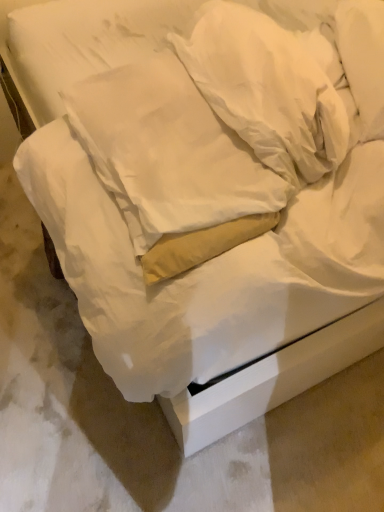
Question: Which direction should I rotate to face white soft pillow at upper center, the first pillow viewed from the right, — up or down?

Choices:
 (A) down
 (B) up

Answer: (B)

Question: Would you say white soft pillow at center, which appears as the 1th pillow when viewed from the left, is outside white soft pillow at upper center, the first pillow viewed from the right?

Choices:
 (A) no
 (B) yes

Answer: (B)

Question: Would you consider white soft pillow at center, the second pillow in the right-to-left sequence, to be distant from white soft pillow at upper center, the first pillow viewed from the right?

Choices:
 (A) yes
 (B) no

Answer: (B)

Question: Considering the relative sizes of white soft pillow at center, which appears as the 1th pillow when viewed from the left, and white soft pillow at upper center, the first pillow viewed from the right, in the image provided, is white soft pillow at center, which appears as the 1th pillow when viewed from the left, shorter than white soft pillow at upper center, the first pillow viewed from the right,?

Choices:
 (A) no
 (B) yes

Answer: (B)

Question: Is white soft pillow at center, which appears as the 1th pillow when viewed from the left, at the right side of white soft pillow at upper center, which is the second pillow in left-to-right order?

Choices:
 (A) yes
 (B) no

Answer: (B)

Question: Would you say white soft pillow at center, the second pillow in the right-to-left sequence, contains white soft pillow at upper center, the first pillow viewed from the right?

Choices:
 (A) no
 (B) yes

Answer: (A)

Question: From a real-world perspective, is white soft pillow at center, the second pillow in the right-to-left sequence, positioned over white soft pillow at upper center, which is the second pillow in left-to-right order, based on gravity?

Choices:
 (A) yes
 (B) no

Answer: (B)

Question: Is white soft pillow at upper center, which is the second pillow in left-to-right order, touching white soft pillow at center, the second pillow in the right-to-left sequence?

Choices:
 (A) no
 (B) yes

Answer: (A)

Question: Is white soft pillow at upper center, which is the second pillow in left-to-right order, further to camera compared to white soft pillow at center, the second pillow in the right-to-left sequence?

Choices:
 (A) yes
 (B) no

Answer: (A)

Question: Is white soft pillow at upper center, which is the second pillow in left-to-right order, to the left of white soft pillow at center, which appears as the 1th pillow when viewed from the left, from the viewer's perspective?

Choices:
 (A) no
 (B) yes

Answer: (A)

Question: Can white soft pillow at center, which appears as the 1th pillow when viewed from the left, be found inside white soft pillow at upper center, which is the second pillow in left-to-right order?

Choices:
 (A) no
 (B) yes

Answer: (A)

Question: Is white soft pillow at upper center, the first pillow viewed from the right, turned away from white soft pillow at center, the second pillow in the right-to-left sequence?

Choices:
 (A) no
 (B) yes

Answer: (B)

Question: Is white soft pillow at upper center, the first pillow viewed from the right, not inside white soft pillow at center, which appears as the 1th pillow when viewed from the left?

Choices:
 (A) no
 (B) yes

Answer: (B)

Question: Do you think white soft pillow at upper center, the first pillow viewed from the right, is within white soft pillow at center, which appears as the 1th pillow when viewed from the left, or outside of it?

Choices:
 (A) inside
 (B) outside

Answer: (B)